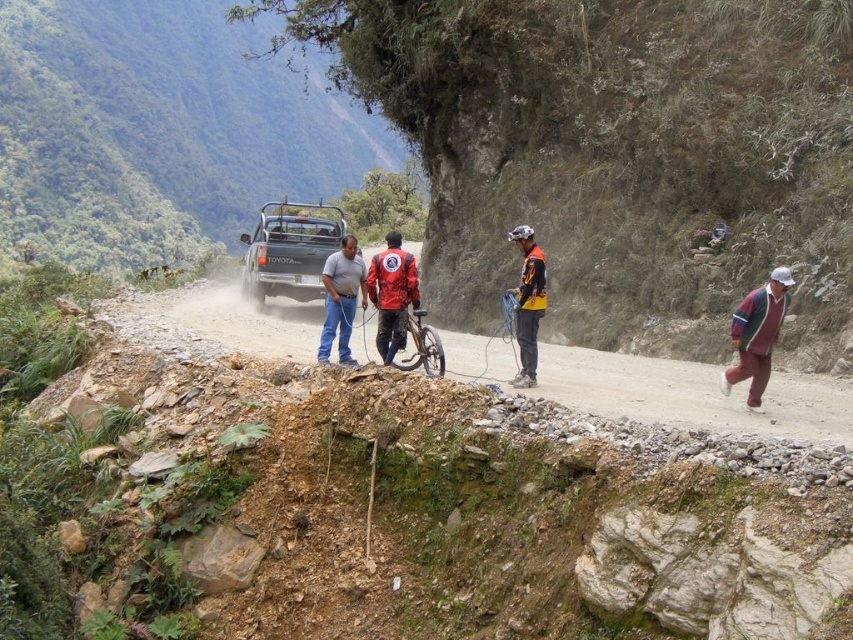
Can you confirm if green grassy hillside at upper left is smaller than shiny metallic bicycle at center?

No.

Locate an element on the screen. Image resolution: width=853 pixels, height=640 pixels. green grassy hillside at upper left is located at coordinates [160, 129].

Can you confirm if green grassy hillside at upper left is taller than matte blue jeans at center?

Indeed, green grassy hillside at upper left has a greater height compared to matte blue jeans at center.

Which is behind, point (165, 241) or point (343, 278)?

Positioned behind is point (165, 241).

Between point (19, 218) and point (329, 282), which one is positioned behind?

Point (19, 218)

Find the location of `green grassy hillside at upper left`. green grassy hillside at upper left is located at coordinates (160, 129).

Consider the image. Is red matte jacket at center wider than matte blue jeans at center?

In fact, red matte jacket at center might be narrower than matte blue jeans at center.

Looking at this image, can you confirm if red matte jacket at center is positioned to the left of matte blue jeans at center?

No, red matte jacket at center is not to the left of matte blue jeans at center.

Does point (376, 340) lie in front of point (349, 241)?

Yes, it is in front of point (349, 241).

In order to click on red matte jacket at center in this screenshot , I will do click(x=392, y=294).